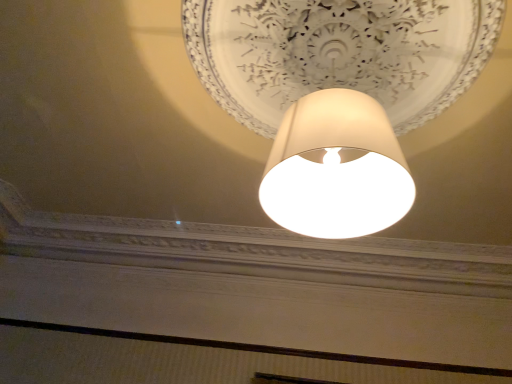
Locate an element on the screen. The image size is (512, 384). matte white lampshade at center is located at coordinates (338, 53).

This screenshot has height=384, width=512. What do you see at coordinates (338, 53) in the screenshot? I see `matte white lampshade at center` at bounding box center [338, 53].

Measure the distance between point (x=440, y=162) and camera.

8.85 feet.

You are a GUI agent. You are given a task and a screenshot of the screen. Output one action in this format:
    pyautogui.click(x=<x>, y=<y>)
    Task: Click on the matte white lampshade at center
    The width and height of the screenshot is (512, 384).
    Given the screenshot: What is the action you would take?
    pyautogui.click(x=338, y=53)